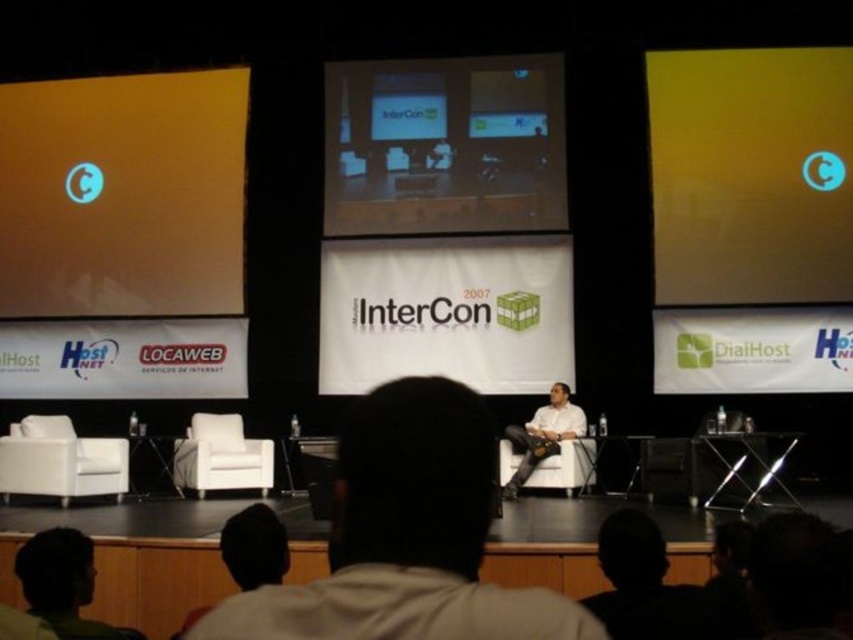
Can you confirm if orange matte projection screen at left is positioned below white fabric chair at center?

Answer: No.

Find the location of `orange matte projection screen at left`. orange matte projection screen at left is located at coordinates (122, 195).

Is orange matte projection screen at left taller than yellow matte screen at upper right?

Yes.

In the scene shown: Which of these two, orange matte projection screen at left or yellow matte screen at upper right, stands taller?

orange matte projection screen at left

Does point (123, 120) come in front of point (724, 252)?

No, it is behind (724, 252).

In order to click on orange matte projection screen at left in this screenshot , I will do `click(122, 195)`.

Between white fabric chair at center and green fabric head at lower left, which one has less height?

With less height is white fabric chair at center.

Who is more forward, [393,387] or [22,547]?

Point [393,387] is in front.

Is point (438, 378) more distant than point (49, 584)?

No, it is in front of (49, 584).

The height and width of the screenshot is (640, 853). I want to click on white fabric chair at center, so click(407, 536).